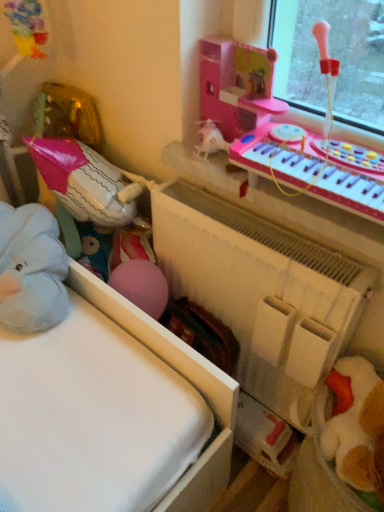
Question: Is white matte radiator at center positioned in front of pink plastic musical keyboard at upper right?

Choices:
 (A) yes
 (B) no

Answer: (B)

Question: Is white matte radiator at center oriented towards pink plastic musical keyboard at upper right?

Choices:
 (A) no
 (B) yes

Answer: (A)

Question: From a real-world perspective, is white matte radiator at center located higher than pink plastic musical keyboard at upper right?

Choices:
 (A) yes
 (B) no

Answer: (B)

Question: Can you confirm if white matte radiator at center is smaller than pink plastic musical keyboard at upper right?

Choices:
 (A) yes
 (B) no

Answer: (B)

Question: From a real-world perspective, does white matte radiator at center sit lower than pink plastic musical keyboard at upper right?

Choices:
 (A) yes
 (B) no

Answer: (A)

Question: Does white matte radiator at center lie behind pink plastic musical keyboard at upper right?

Choices:
 (A) yes
 (B) no

Answer: (A)

Question: Is the position of pink plastic musical keyboard at upper right less distant than that of white matte radiator at center?

Choices:
 (A) no
 (B) yes

Answer: (B)

Question: Can white matte radiator at center be found inside pink plastic musical keyboard at upper right?

Choices:
 (A) no
 (B) yes

Answer: (A)

Question: Does pink plastic musical keyboard at upper right come behind white matte radiator at center?

Choices:
 (A) yes
 (B) no

Answer: (B)

Question: From the image's perspective, is pink plastic musical keyboard at upper right located beneath white matte radiator at center?

Choices:
 (A) no
 (B) yes

Answer: (A)

Question: Considering the relative sizes of pink plastic musical keyboard at upper right and white matte radiator at center in the image provided, is pink plastic musical keyboard at upper right thinner than white matte radiator at center?

Choices:
 (A) no
 (B) yes

Answer: (A)

Question: From the image's perspective, is pink plastic musical keyboard at upper right on white matte radiator at center?

Choices:
 (A) no
 (B) yes

Answer: (B)

Question: Is white matte radiator at center wider or thinner than pink plastic musical keyboard at upper right?

Choices:
 (A) thin
 (B) wide

Answer: (A)